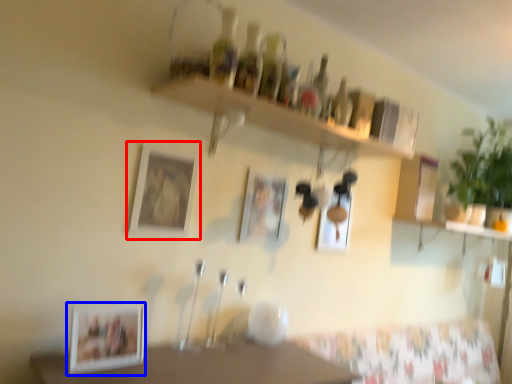
Question: Which object is closer to the camera taking this photo, picture frame (highlighted by a red box) or picture frame (highlighted by a blue box)?

Choices:
 (A) picture frame
 (B) picture frame

Answer: (B)